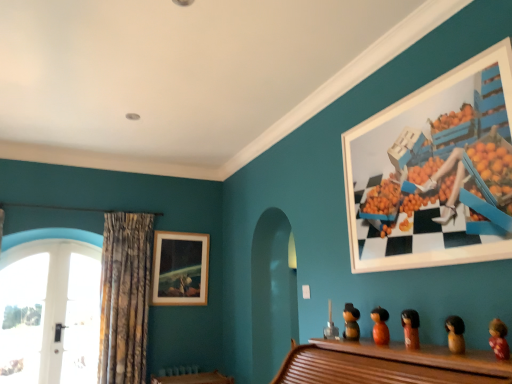
Question: Is wooden picture frame at upper center, which appears as the 2th picture frame when viewed from the front, at the left side of brown wooden doll at lower right, which ranks as the fourth toy in back-to-front order?

Choices:
 (A) yes
 (B) no

Answer: (A)

Question: Is brown wooden doll at lower right, which ranks as the fourth toy in back-to-front order, at the back of wooden picture frame at upper center, acting as the first picture frame starting from the bottom?

Choices:
 (A) yes
 (B) no

Answer: (B)

Question: From the image's perspective, would you say wooden picture frame at upper center, acting as the first picture frame starting from the bottom, is shown under brown wooden doll at lower right, which ranks as the fourth toy in back-to-front order?

Choices:
 (A) yes
 (B) no

Answer: (A)

Question: Does wooden picture frame at upper center, acting as the first picture frame starting from the bottom, have a smaller size compared to brown wooden doll at lower right, which is the fourth toy in left-to-right order?

Choices:
 (A) no
 (B) yes

Answer: (A)

Question: Considering the relative positions of wooden picture frame at upper center, the 2th picture frame when ordered from top to bottom, and brown wooden doll at lower right, which ranks as the fourth toy in back-to-front order, in the image provided, is wooden picture frame at upper center, the 2th picture frame when ordered from top to bottom, in front of brown wooden doll at lower right, which ranks as the fourth toy in back-to-front order,?

Choices:
 (A) no
 (B) yes

Answer: (A)

Question: From the image's perspective, is wooden picture frame at upper center, acting as the first picture frame starting from the bottom, above or below brown wooden figurine at center, acting as the 3th toy starting from the back?

Choices:
 (A) above
 (B) below

Answer: (B)

Question: Is point (180, 284) closer or farther from the camera than point (416, 314)?

Choices:
 (A) farther
 (B) closer

Answer: (A)

Question: Which is correct: wooden picture frame at upper center, marked as the 1th picture frame in a back-to-front arrangement, is inside brown wooden figurine at center, the third toy positioned from the right, or outside of it?

Choices:
 (A) outside
 (B) inside

Answer: (A)

Question: From a real-world perspective, is wooden picture frame at upper center, placed as the 2th picture frame when sorted from right to left, physically located above or below brown wooden figurine at center, the third toy positioned from the right?

Choices:
 (A) below
 (B) above

Answer: (B)

Question: Considering the positions of brown wooden figurine at center, which is the third toy from left to right, and wooden figurine at center, positioned as the fifth toy in front-to-back order, in the image, is brown wooden figurine at center, which is the third toy from left to right, taller or shorter than wooden figurine at center, positioned as the fifth toy in front-to-back order,?

Choices:
 (A) tall
 (B) short

Answer: (B)

Question: Which is correct: brown wooden figurine at center, which is the 3th toy from front to back, is inside wooden figurine at center, which is the 1th toy in back-to-front order, or outside of it?

Choices:
 (A) outside
 (B) inside

Answer: (A)

Question: From a real-world perspective, relative to wooden figurine at center, positioned as the fifth toy in front-to-back order, is brown wooden figurine at center, the third toy positioned from the right, vertically above or below?

Choices:
 (A) below
 (B) above

Answer: (A)

Question: Relative to wooden figurine at center, which is the 1th toy in back-to-front order, is brown wooden figurine at center, which is the 3th toy from front to back, in front or behind?

Choices:
 (A) front
 (B) behind

Answer: (A)

Question: Considering the relative positions of fluffy pink doll at lower right, acting as the fifth toy starting from the back, and brown wooden figurine at center, which is the 3th toy from front to back, in the image provided, is fluffy pink doll at lower right, acting as the fifth toy starting from the back, to the left or to the right of brown wooden figurine at center, which is the 3th toy from front to back,?

Choices:
 (A) right
 (B) left

Answer: (A)

Question: From a real-world perspective, is fluffy pink doll at lower right, which ranks as the 1th toy in right-to-left order, above or below brown wooden figurine at center, which is the third toy from left to right?

Choices:
 (A) below
 (B) above

Answer: (A)